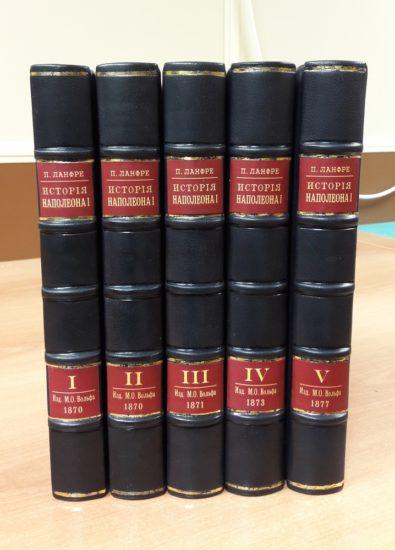
Identify the location of wood table. The image size is (395, 550). click(370, 319), click(197, 528), click(15, 368).